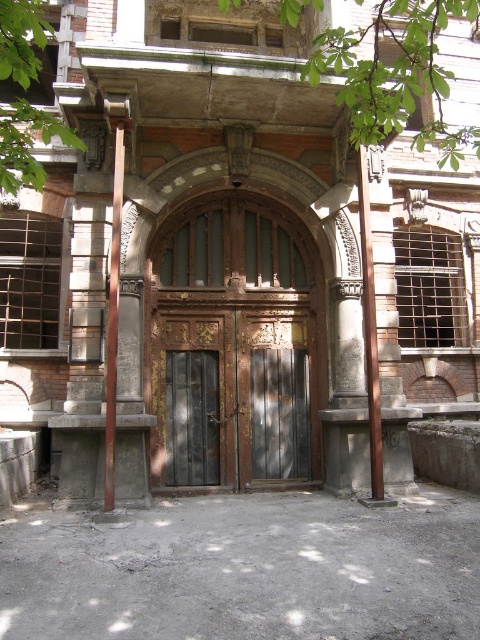
Question: Which of the following is the farthest from the observer?

Choices:
 (A) wooden door at center
 (B) brown wood post at right

Answer: (A)

Question: Does wooden door at center appear on the left side of brown wood post at right?

Choices:
 (A) no
 (B) yes

Answer: (B)

Question: Does wooden door at center have a greater width compared to brown wood post at right?

Choices:
 (A) yes
 (B) no

Answer: (A)

Question: Is wooden door at center wider than brown wood post at right?

Choices:
 (A) yes
 (B) no

Answer: (A)

Question: Which point appears farthest from the camera in this image?

Choices:
 (A) (158, 394)
 (B) (374, 438)

Answer: (A)